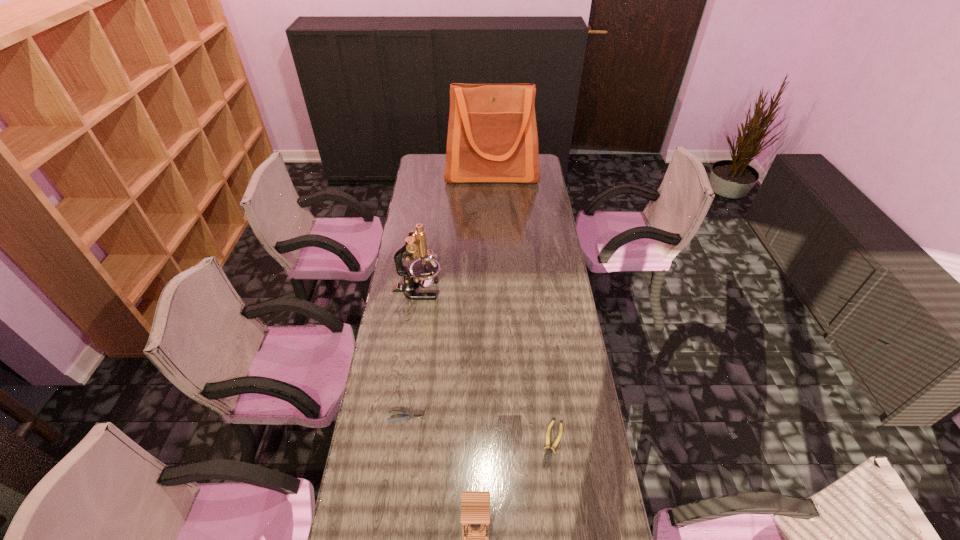
Locate an element on the screen. shopping bag is located at coordinates (492, 137).

Where is `the farthest object`? The image size is (960, 540). the farthest object is located at coordinates (492, 137).

What are the coordinates of `the second farthest object` in the screenshot? It's located at (423, 271).

Find the location of `the second tallest object`. the second tallest object is located at coordinates (423, 271).

Where is `the left pliers`? The height and width of the screenshot is (540, 960). the left pliers is located at coordinates (409, 415).

In order to click on the shortest object in this screenshot , I will do `click(547, 456)`.

Find the location of a particular element. The image size is (960, 540). the shorter pliers is located at coordinates (547, 456).

You are a GUI agent. You are given a task and a screenshot of the screen. Output one action in this format:
    pyautogui.click(x=<x>, y=<y>)
    Task: Click on the vacant space located 0.230m on the front pocket of the shopping bag
    
    Given the screenshot: What is the action you would take?
    pyautogui.click(x=492, y=212)

Locate an element on the screen. The image size is (960, 540). free space located at the eyepiece of the fourth shortest object is located at coordinates (537, 290).

At what (x,y) coordinates should I click in order to perform the action: click on vacant area situated at the gripping part of the left pliers. Please return your answer as a coordinate pair (x, y). Looking at the image, I should click on (534, 417).